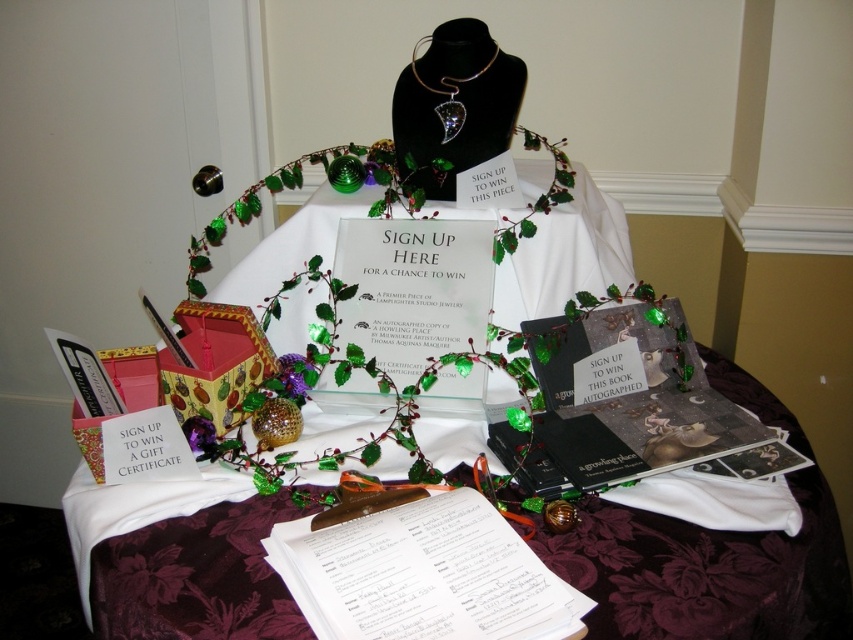
Question: Is the position of burgundy velvet tablecloth at lower center less distant than that of swarovski crystal pendant at center?

Choices:
 (A) yes
 (B) no

Answer: (A)

Question: In this image, where is burgundy velvet tablecloth at lower center located relative to swarovski crystal pendant at center?

Choices:
 (A) above
 (B) below

Answer: (B)

Question: Is burgundy velvet tablecloth at lower center closer to camera compared to swarovski crystal pendant at center?

Choices:
 (A) no
 (B) yes

Answer: (B)